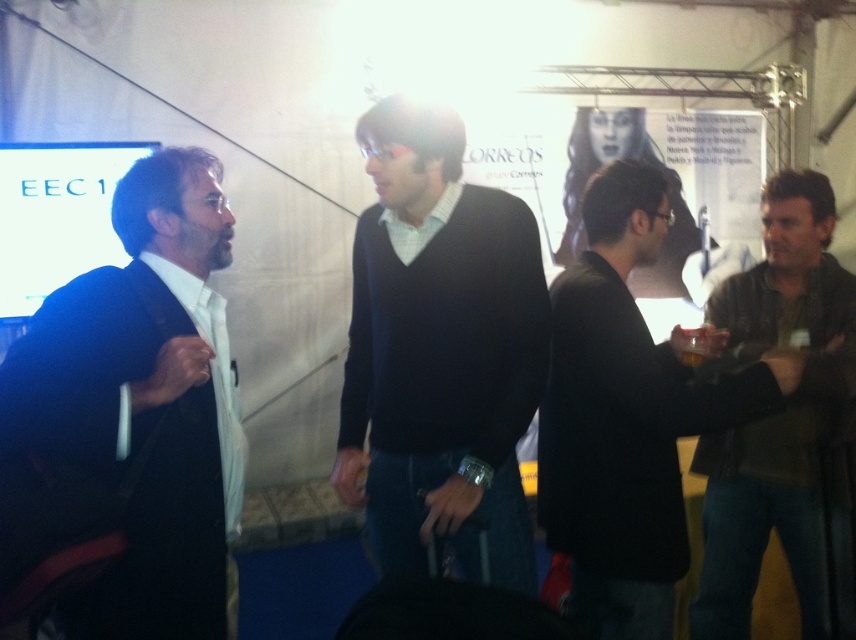
Is dark blue suit at left to the right of dark blue sweater at center from the viewer's perspective?

In fact, dark blue suit at left is to the left of dark blue sweater at center.

Between dark blue suit at left and dark blue sweater at center, which one is positioned higher?

dark blue sweater at center is above.

This screenshot has height=640, width=856. What do you see at coordinates (132, 417) in the screenshot? I see `dark blue suit at left` at bounding box center [132, 417].

At what (x,y) coordinates should I click in order to perform the action: click on dark blue suit at left. Please return your answer as a coordinate pair (x, y). The image size is (856, 640). Looking at the image, I should click on (132, 417).

Does dark brown leather jacket at right have a lesser height compared to leather jacket at right?

Indeed, dark brown leather jacket at right has a lesser height compared to leather jacket at right.

Image resolution: width=856 pixels, height=640 pixels. What are the coordinates of `dark brown leather jacket at right` in the screenshot? It's located at (626, 417).

At what (x,y) coordinates should I click in order to perform the action: click on dark brown leather jacket at right. Please return your answer as a coordinate pair (x, y). This screenshot has height=640, width=856. Looking at the image, I should click on (626, 417).

The image size is (856, 640). Describe the element at coordinates (440, 349) in the screenshot. I see `dark blue sweater at center` at that location.

Who is positioned more to the right, dark blue sweater at center or white paper poster at center?

white paper poster at center is more to the right.

This screenshot has height=640, width=856. In order to click on dark blue sweater at center in this screenshot , I will do `click(440, 349)`.